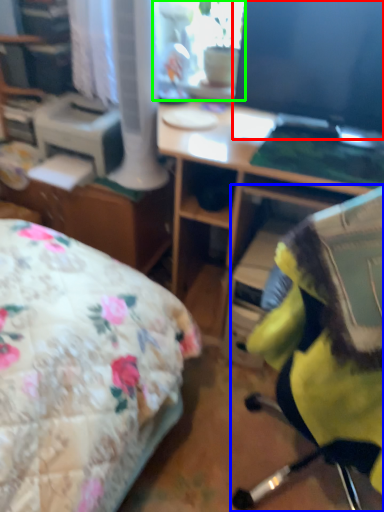
Question: Which object is the farthest from computer monitor (highlighted by a red box)? Choose among these: chair (highlighted by a blue box) or window screen (highlighted by a green box).

Choices:
 (A) chair
 (B) window screen

Answer: (A)